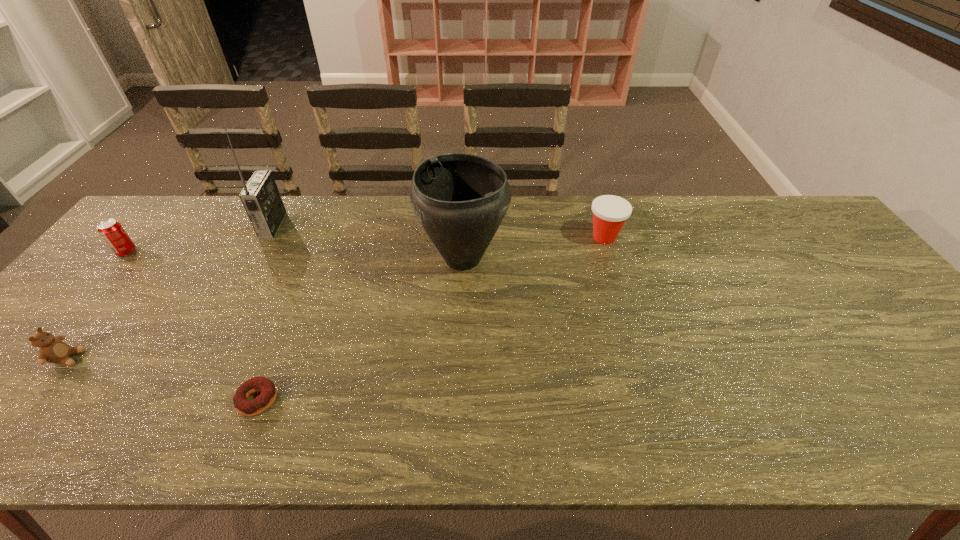
The image size is (960, 540). What are the coordinates of `vacant space located 0.230m on the right of the rightmost object` in the screenshot? It's located at (698, 237).

Find the location of a particular element. Image resolution: width=960 pixels, height=540 pixels. vacant space situated on the right of the soda is located at coordinates (258, 252).

I want to click on free space located on the front-facing side of the fifth farthest object, so click(132, 358).

Where is `vacant region located on the left of the nearest object`? vacant region located on the left of the nearest object is located at coordinates (205, 400).

Identify the location of radio receiver located in the far edge section of the desktop. click(261, 199).

This screenshot has width=960, height=540. I want to click on urn positioned at the far edge, so click(x=460, y=199).

Where is `Dixie cup that is at the far edge`? The image size is (960, 540). Dixie cup that is at the far edge is located at coordinates pos(610,212).

The image size is (960, 540). What are the coordinates of `object that is at the near edge` in the screenshot? It's located at (268, 389).

The image size is (960, 540). Identify the location of soda that is positioned at the left edge. (112, 232).

This screenshot has height=540, width=960. I want to click on teddy bear that is positioned at the left edge, so click(x=52, y=349).